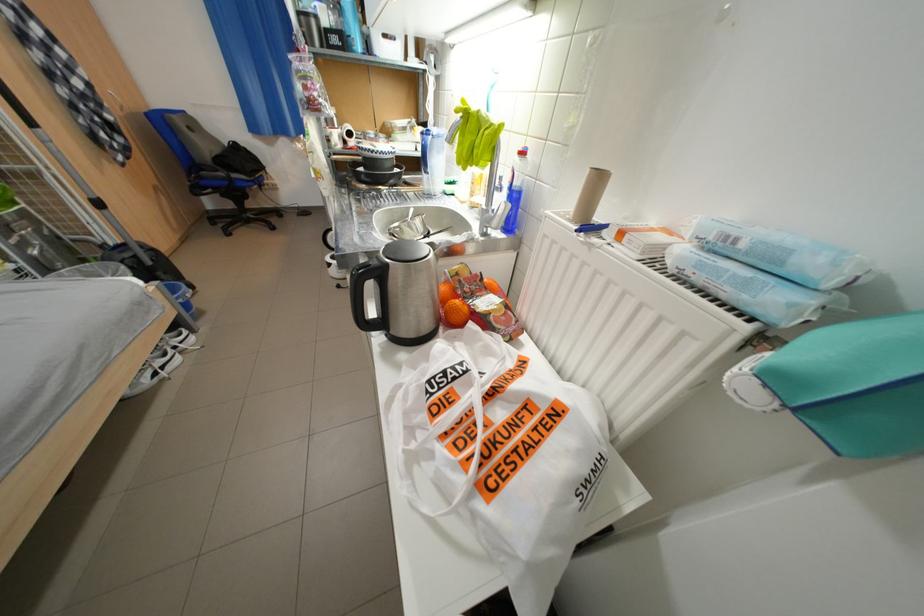
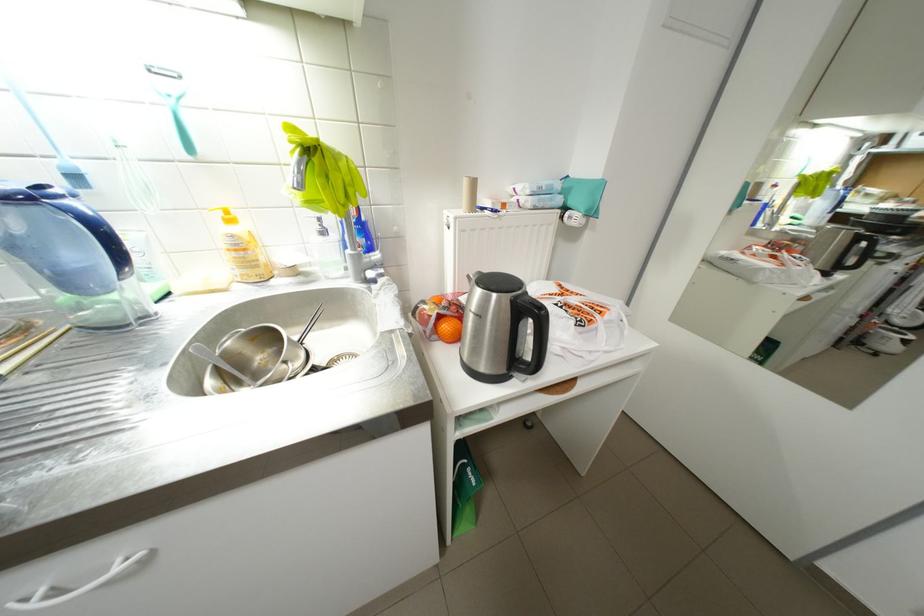
First-person continuous shooting, in which direction is the camera rotating?

The camera's rotation is toward right-down.